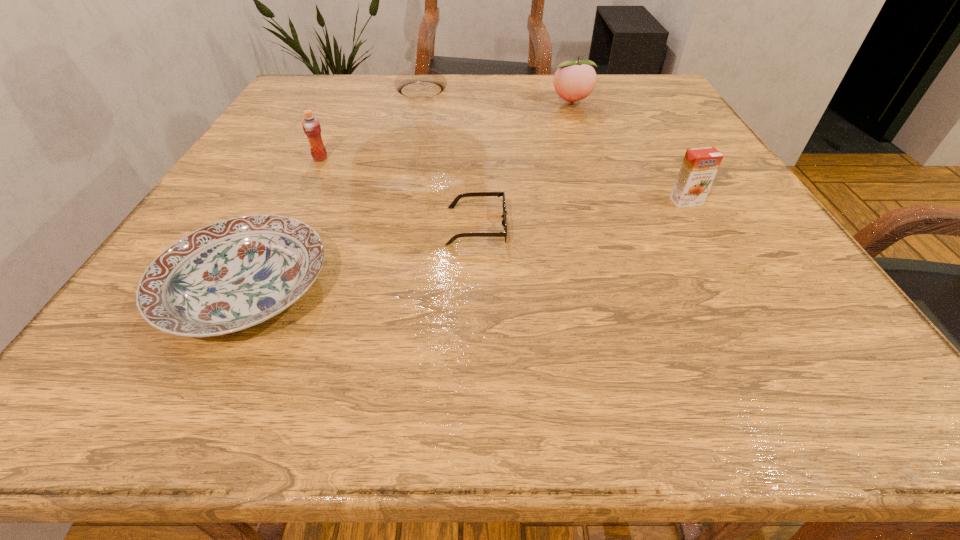
This screenshot has height=540, width=960. Find the location of `vacant point located between the table lamp and the fifth object from left to right`. vacant point located between the table lamp and the fifth object from left to right is located at coordinates (496, 97).

Where is `free space between the plate and the right orange juice`? free space between the plate and the right orange juice is located at coordinates (x=466, y=245).

Where is `free spot between the tallest object and the right orange juice`? This screenshot has height=540, width=960. free spot between the tallest object and the right orange juice is located at coordinates (554, 146).

The height and width of the screenshot is (540, 960). Find the location of `vacant area that lies between the peach and the plate`. vacant area that lies between the peach and the plate is located at coordinates (409, 195).

Where is `empty space between the second object from right to left and the plate`? empty space between the second object from right to left and the plate is located at coordinates (409, 195).

You are a GUI agent. You are given a task and a screenshot of the screen. Output one action in this format:
    pyautogui.click(x=<x>, y=<y>)
    Task: Click on the free spot between the rightmost object and the sunglasses
    
    Given the screenshot: What is the action you would take?
    pyautogui.click(x=582, y=214)

Where is `unoccupied position between the plate and the second object from right to left`? Image resolution: width=960 pixels, height=540 pixels. unoccupied position between the plate and the second object from right to left is located at coordinates (409, 195).

You are a GUI agent. You are given a task and a screenshot of the screen. Output one action in this format:
    pyautogui.click(x=<x>, y=<y>)
    Task: Click on the vacant space that's between the rightmost object and the left orange juice
    
    Given the screenshot: What is the action you would take?
    pyautogui.click(x=503, y=180)

Find the location of `object that stands as the third closest to the third farthest object`. object that stands as the third closest to the third farthest object is located at coordinates (474, 194).

Image resolution: width=960 pixels, height=540 pixels. Identify the location of object that is the fourth closest to the sunglasses. (419, 82).